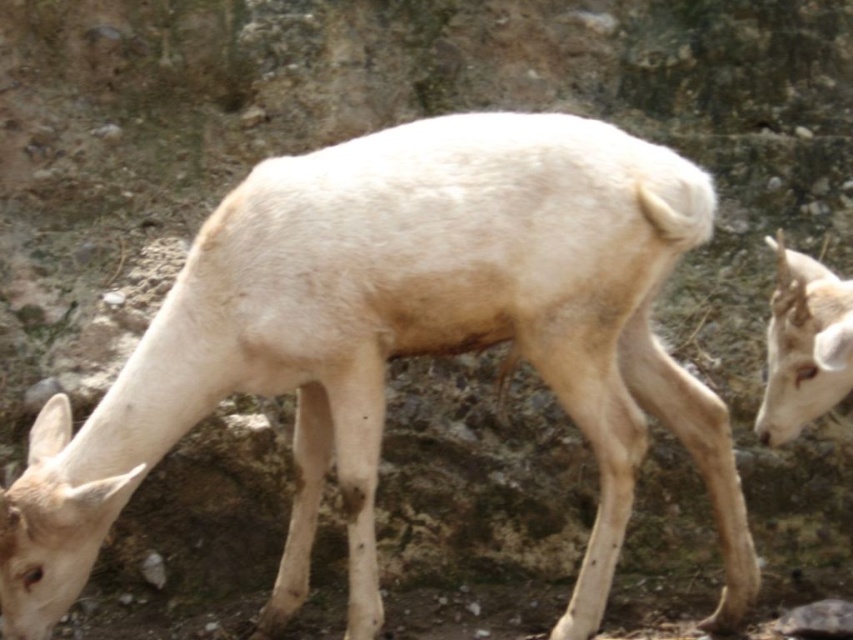
Looking at this image, you are a wildlife photographer aiming to capture a close shot of the white woolen deer at center. Given that your camera has a focal length of 200mm and you are positioned at point 0.3, 0.3, can you determine if you are within the optimal shooting range to get a clear image of the deer?

The white woolen deer at center is located at point (398, 340). Since your position is at (254, 192), you need to move closer to the deer to be within the optimal shooting range for a 200mm lens.